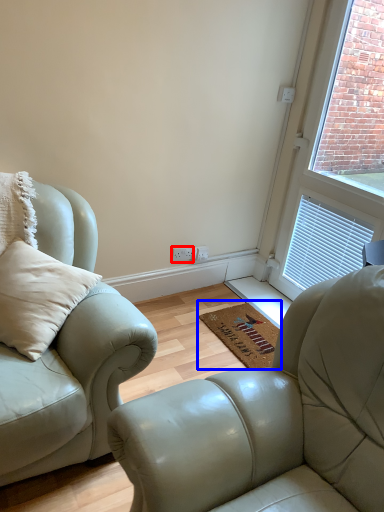
Question: Which object is closer to the camera taking this photo, electric outlet (highlighted by a red box) or doormat (highlighted by a blue box)?

Choices:
 (A) electric outlet
 (B) doormat

Answer: (B)